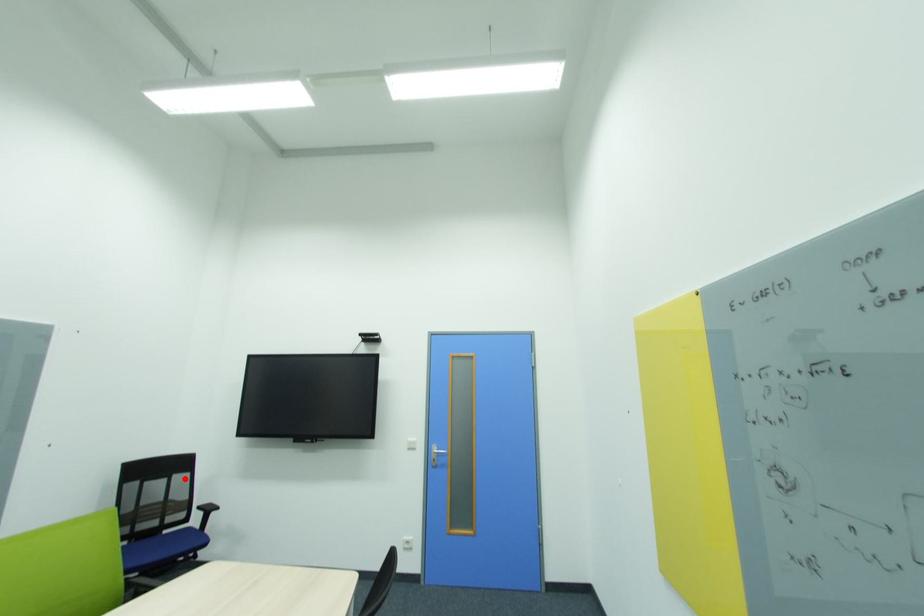
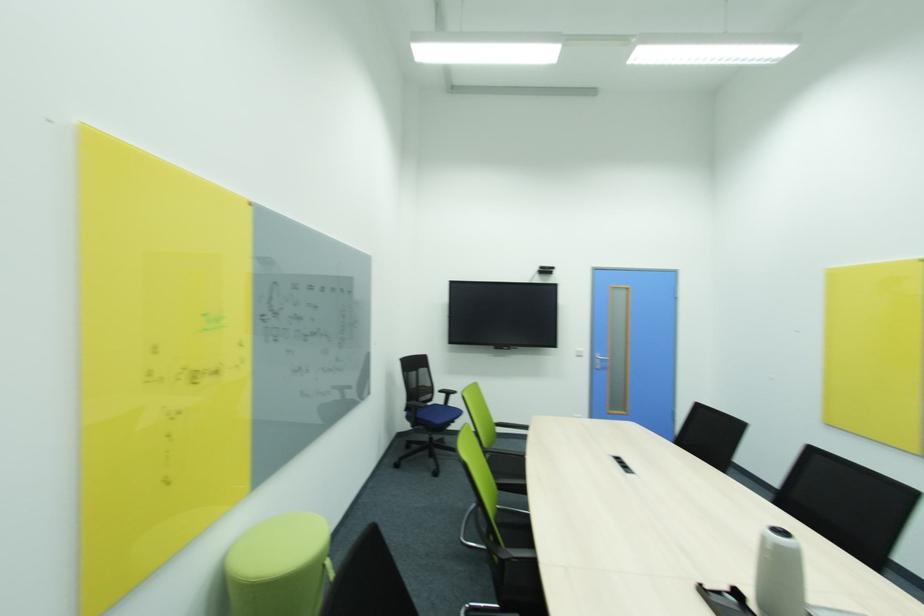
In the second image, find the point that corresponds to the highlighted location in the first image.

(428, 371)